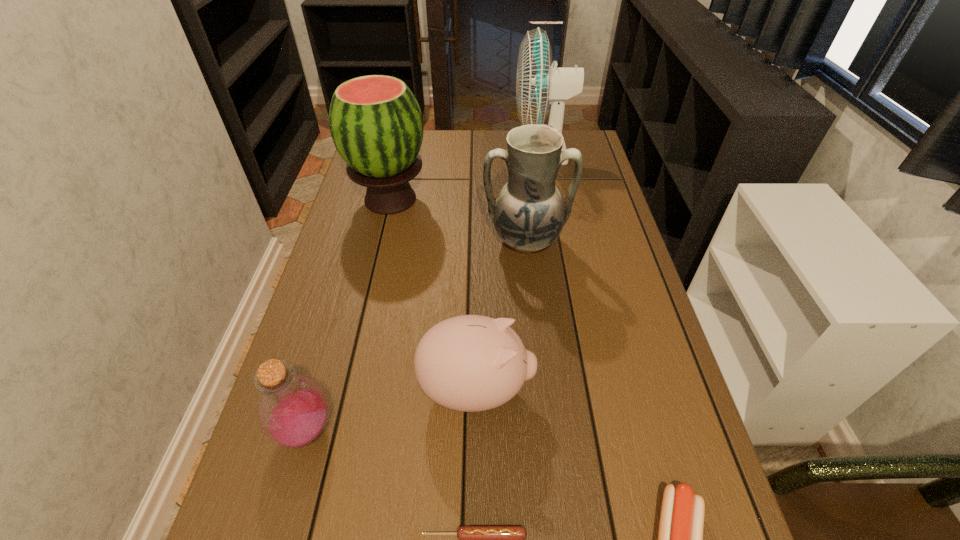
Image resolution: width=960 pixels, height=540 pixels. In the image, there is a desktop. What are the coordinates of `free region at the right edge` in the screenshot? It's located at (608, 229).

Find the location of `empty space that is in between the piggy bank and the watermelon`. empty space that is in between the piggy bank and the watermelon is located at coordinates tap(433, 294).

Where is `free spot between the pitcher and the watermelon`? free spot between the pitcher and the watermelon is located at coordinates (458, 220).

At what (x,y) coordinates should I click in order to perform the action: click on free space that is in between the piggy bank and the bottle. Please return your answer as a coordinate pair (x, y). This screenshot has width=960, height=540. Looking at the image, I should click on (392, 410).

This screenshot has height=540, width=960. What are the coordinates of `object that is the sixth nearest to the piggy bank` in the screenshot? It's located at (538, 84).

Select which object appears as the fifth closest to the bottle. Please provide its 2D coordinates. Your answer should be formatted as a tuple, i.e. [(x, y)], where the tuple contains the x and y coordinates of a point satisfying the conditions above.

[(375, 121)]